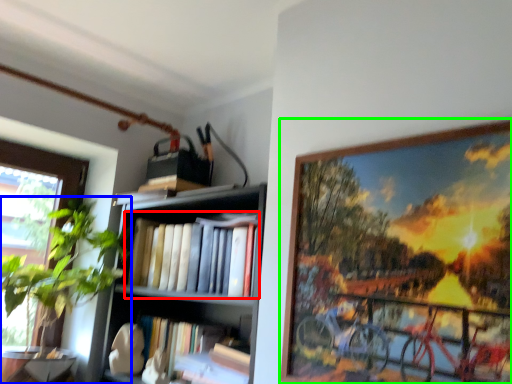
Question: Considering the real-world distances, which object is closest to book (highlighted by a red box)? houseplant (highlighted by a blue box) or picture frame (highlighted by a green box).

Choices:
 (A) houseplant
 (B) picture frame

Answer: (A)